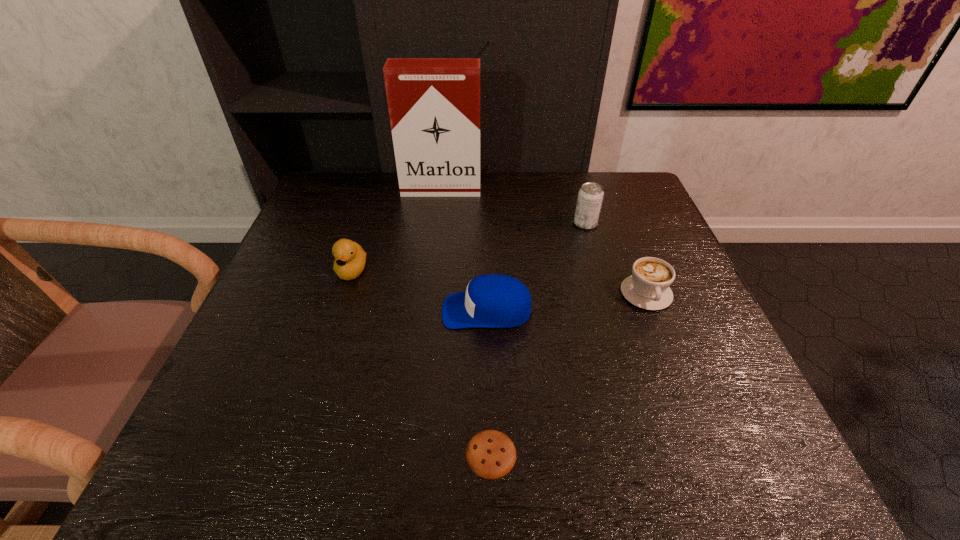
In order to click on cigarette_case in this screenshot , I will do `click(434, 103)`.

Locate an element on the screen. This screenshot has height=540, width=960. the farthest object is located at coordinates (434, 103).

Find the location of a particular element. the fifth nearest object is located at coordinates (590, 197).

Identify the location of soda can. This screenshot has height=540, width=960. (590, 197).

You are a GUI agent. You are given a task and a screenshot of the screen. Output one action in this format:
    pyautogui.click(x=<x>, y=<y>)
    Task: Click on the leftmost object
    
    Given the screenshot: What is the action you would take?
    (x=350, y=258)

This screenshot has width=960, height=540. Identify the location of baseball cap. click(x=492, y=301).

The image size is (960, 540). I want to click on the rightmost object, so click(648, 288).

What are the coordinates of `the nearest object` in the screenshot? It's located at (490, 454).

I want to click on cookie, so click(490, 454).

Find the location of a particular element. free location located 0.220m on the front-facing side of the cigarette_case is located at coordinates (435, 246).